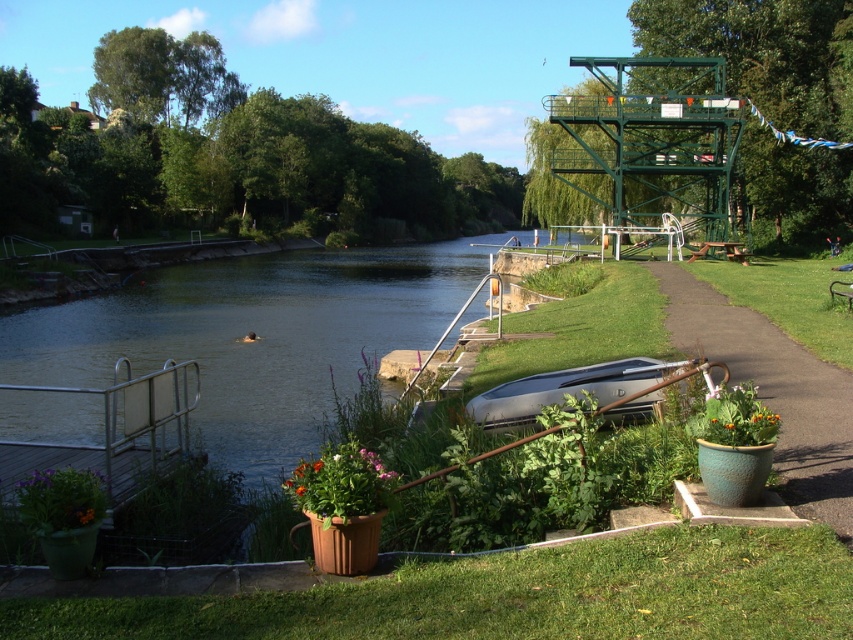
Is greenish-gray concrete river at center-left bigger than green leafy plant at center?

Correct, greenish-gray concrete river at center-left is larger in size than green leafy plant at center.

Does greenish-gray concrete river at center-left have a smaller size compared to green leafy plant at center?

No, greenish-gray concrete river at center-left is not smaller than green leafy plant at center.

Image resolution: width=853 pixels, height=640 pixels. In order to click on greenish-gray concrete river at center-left in this screenshot , I will do [256, 333].

Who is taller, matte terracotta pot at lower center or metallic silver boat at lower center?

Standing taller between the two is metallic silver boat at lower center.

Which is in front, point (173, 627) or point (531, 380)?

Positioned in front is point (173, 627).

Where is `matte terracotta pot at lower center`? The height and width of the screenshot is (640, 853). matte terracotta pot at lower center is located at coordinates (515, 595).

Can you confirm if matte terracotta pot at lower center is bigger than green ceramic pot at right?

No.

The height and width of the screenshot is (640, 853). What do you see at coordinates (515, 595) in the screenshot?
I see `matte terracotta pot at lower center` at bounding box center [515, 595].

Who is more forward, (635, 532) or (761, 348)?

Point (635, 532) is more forward.

Where is `matte terracotta pot at lower center`? matte terracotta pot at lower center is located at coordinates (515, 595).